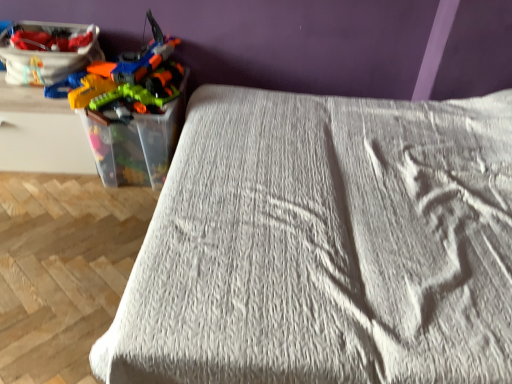
Question: Does point [95, 36] appear closer or farther from the camera than point [208, 193]?

Choices:
 (A) closer
 (B) farther

Answer: (B)

Question: Visually, is matte plastic toy box at upper left positioned to the left or to the right of white textured bed at center?

Choices:
 (A) right
 (B) left

Answer: (B)

Question: Which object is positioned farthest from the matte plastic toy box at upper left?

Choices:
 (A) white textured bed at center
 (B) translucent plastic toy guns at left

Answer: (A)

Question: Considering the real-world distances, which object is farthest from the matte plastic toy box at upper left?

Choices:
 (A) white textured bed at center
 (B) translucent plastic toy guns at left

Answer: (A)